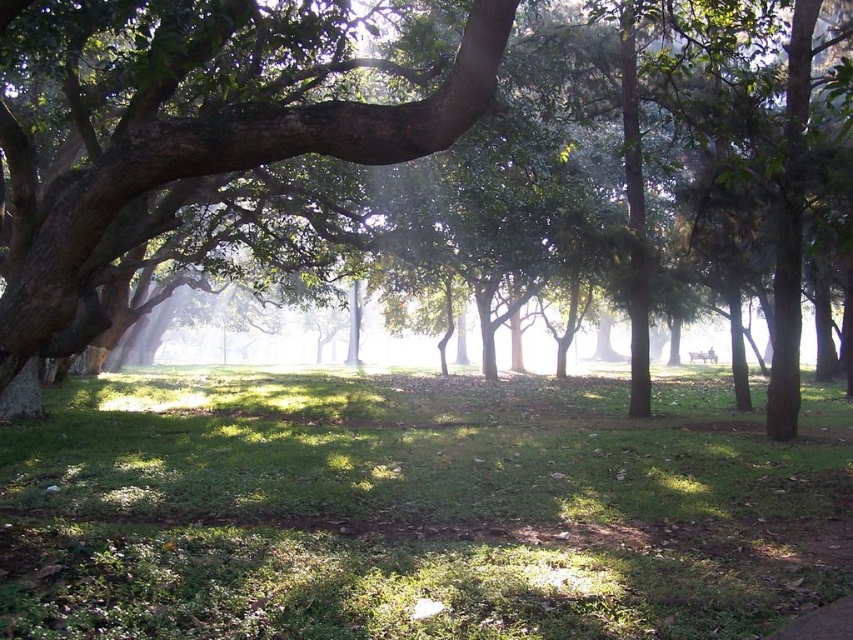
Question: Which point appears farthest from the camera in this image?

Choices:
 (A) (476, 412)
 (B) (462, 81)

Answer: (A)

Question: In this image, where is green grassy at center located relative to green leafy tree at center?

Choices:
 (A) above
 (B) below

Answer: (B)

Question: Is green grassy at center to the left of green leafy tree at center from the viewer's perspective?

Choices:
 (A) no
 (B) yes

Answer: (A)

Question: Can you confirm if green grassy at center is thinner than green leafy tree at center?

Choices:
 (A) yes
 (B) no

Answer: (B)

Question: Which point is closer to the camera?

Choices:
 (A) (439, 552)
 (B) (99, 264)

Answer: (A)